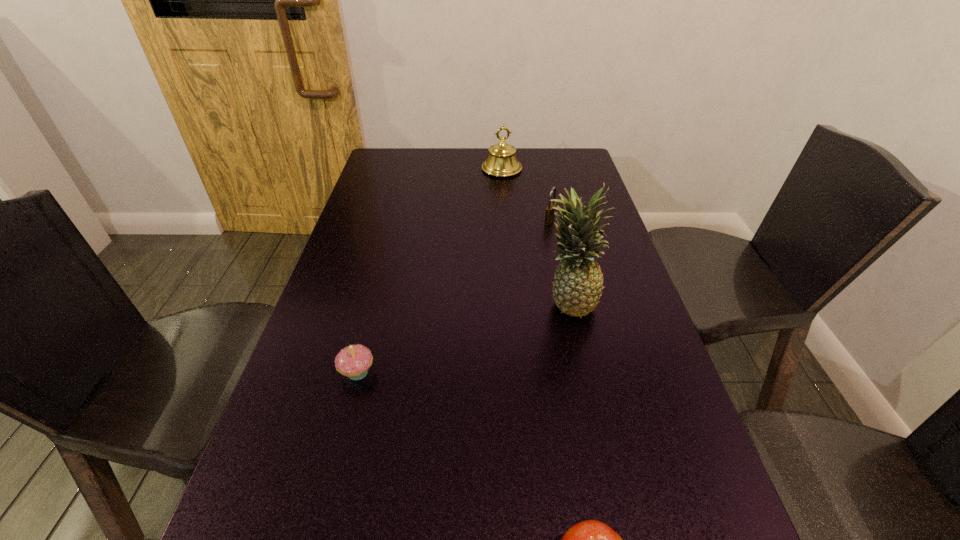
At what (x,y) coordinates should I click in order to perform the action: click on the third nearest object. Please return your answer as a coordinate pair (x, y). This screenshot has height=540, width=960. Looking at the image, I should click on (577, 287).

Find the location of a particular element. Image resolution: width=960 pixels, height=540 pixels. the tallest object is located at coordinates (577, 287).

Find the location of a particular element. This screenshot has width=960, height=540. bell is located at coordinates (502, 162).

This screenshot has height=540, width=960. I want to click on the farthest object, so click(502, 162).

Locate an element on the screen. The width and height of the screenshot is (960, 540). the second farthest object is located at coordinates (550, 212).

The image size is (960, 540). I want to click on the fourth farthest object, so click(353, 361).

Where is `the leftmost object`? This screenshot has height=540, width=960. the leftmost object is located at coordinates (353, 361).

Identify the location of free space located on the left of the third nearest object. (517, 302).

Image resolution: width=960 pixels, height=540 pixels. In order to click on vacant position located on the left of the bell in this screenshot , I will do `click(445, 169)`.

At what (x,y) coordinates should I click in order to perform the action: click on free region located on the left of the fourth nearest object. Please return your answer as a coordinate pair (x, y). Looking at the image, I should click on click(474, 220).